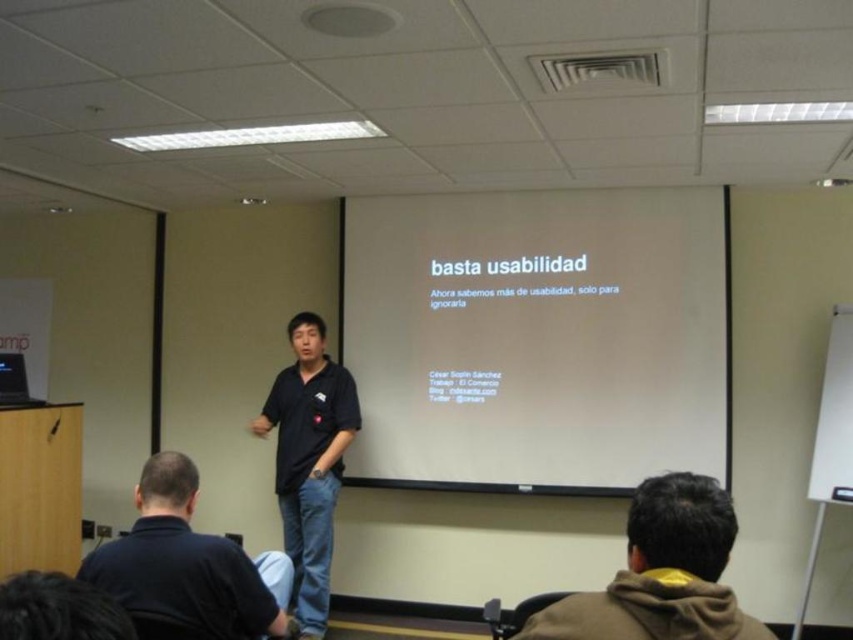
You are organizing a presentation and need to decide where to place a 1.8m tall standing screen. The room has a white matte projection screen at center and a brown fleece jacket at lower right. Which object is taller and can accommodate the screen?

The white matte projection screen at center is taller than the brown fleece jacket at lower right, so the screen can accommodate the 1.8m tall standing screen.

You are standing in the conference room and want to locate the dark blue shirt at lower left. What are its coordinates?

The dark blue shirt at lower left is located at coordinates (186, 566).

You are organizing a presentation and need to decide which clothing item to place on a hanger. The hanger can only hold items up to the height of the black matte shirt at center. Can the brown fleece jacket at lower right be safely placed on the hanger?

The brown fleece jacket at lower right is shorter than the black matte shirt at center, so it can be safely placed on the hanger since it is shorter than the maximum allowed height.